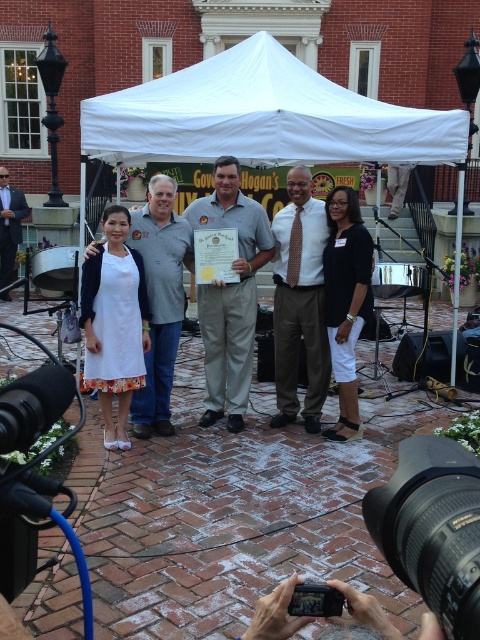
Question: Is white fabric canopy at center bigger than khaki cotton pants at center?

Choices:
 (A) yes
 (B) no

Answer: (A)

Question: Is brown textured tie at center bigger than black plastic camera at lower center?

Choices:
 (A) yes
 (B) no

Answer: (A)

Question: Which of the following is the closest to the observer?

Choices:
 (A) black matte pants at center
 (B) black plastic camera at lower right

Answer: (B)

Question: Is white fabric canopy at center below black plastic camera at lower center?

Choices:
 (A) no
 (B) yes

Answer: (A)

Question: Based on their relative distances, which object is farther from the brown textured tie at center?

Choices:
 (A) black matte pants at center
 (B) khaki cotton pants at center

Answer: (B)

Question: Which of the following is the closest to the observer?

Choices:
 (A) (152, 419)
 (B) (346, 221)
 (C) (459, 538)

Answer: (C)